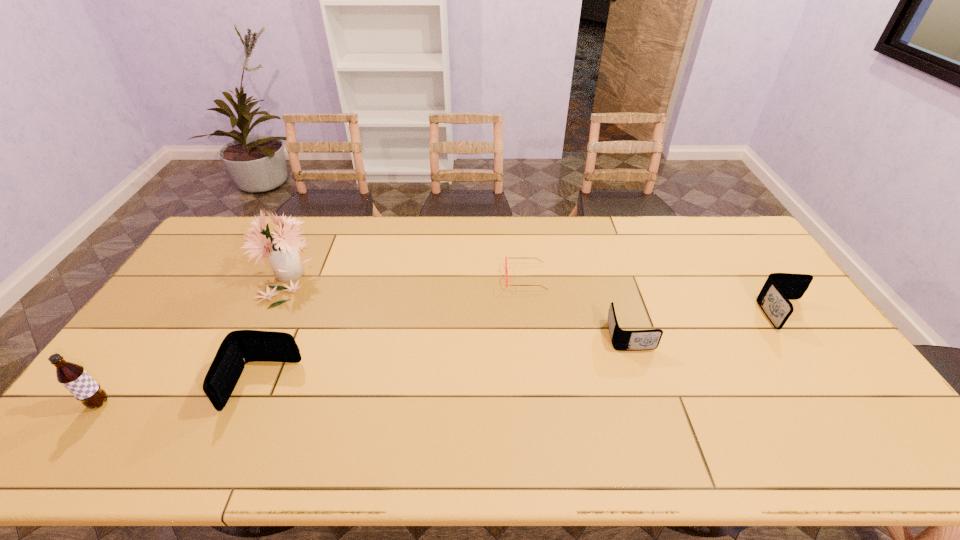
You are a GUI agent. You are given a task and a screenshot of the screen. Output one action in this format:
    pyautogui.click(x=<x>, y=<y>)
    Task: Click on the object situated at the left edge
    
    Given the screenshot: What is the action you would take?
    pyautogui.click(x=73, y=377)

Where is `object at the right edge`? The height and width of the screenshot is (540, 960). object at the right edge is located at coordinates tap(779, 288).

This screenshot has width=960, height=540. I want to click on object that is at the near left corner, so click(x=73, y=377).

The height and width of the screenshot is (540, 960). Find the location of `free location at the far edge of the desktop`. free location at the far edge of the desktop is located at coordinates (561, 220).

This screenshot has width=960, height=540. Identify the location of free location at the near edge. (677, 406).

The height and width of the screenshot is (540, 960). I want to click on vacant region at the left edge, so click(207, 274).

Locate an element on the screen. This screenshot has width=960, height=540. vacant space at the right edge is located at coordinates (764, 280).

I want to click on blank space at the far left corner of the desktop, so click(x=256, y=216).

Where is `vacant area at the near right corner of the desktop`? This screenshot has width=960, height=540. vacant area at the near right corner of the desktop is located at coordinates (853, 390).

Locate an element on the screen. free space between the spectacles and the tallest object is located at coordinates (406, 275).